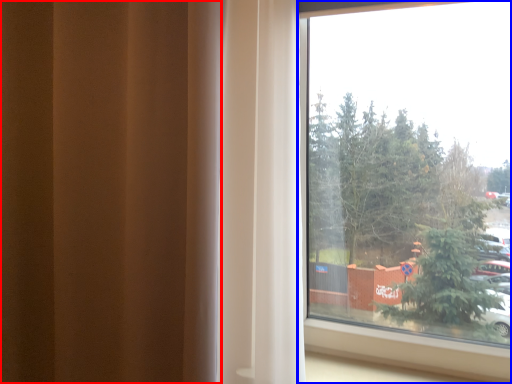
Question: Among these objects, which one is nearest to the camera, curtain (highlighted by a red box) or window (highlighted by a blue box)?

Choices:
 (A) curtain
 (B) window

Answer: (A)